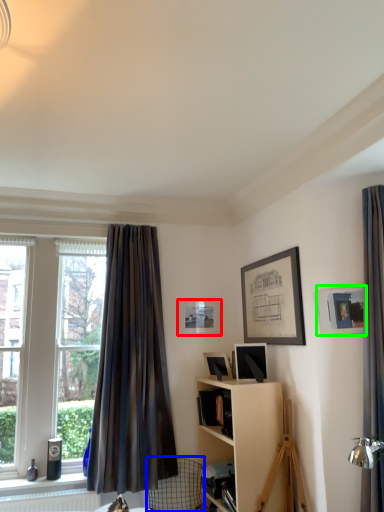
Question: Based on their relative distances, which object is farther from picture frame (highlighted by a red box)? Choose from swivel chair (highlighted by a blue box) and picture frame (highlighted by a green box).

Choices:
 (A) swivel chair
 (B) picture frame

Answer: (B)